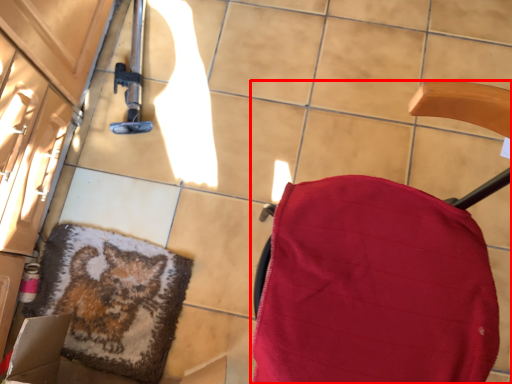
Question: Observing the image, what is the correct spatial positioning of furniture (annotated by the red box) in reference to mat?

Choices:
 (A) right
 (B) left

Answer: (A)